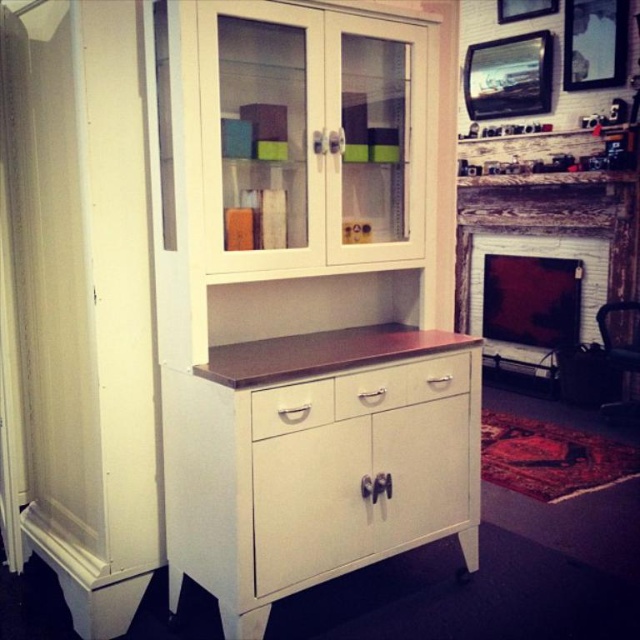
Based on the photo, between white wood dresser at center and white brick fireplace at center, which one is positioned lower?

white wood dresser at center is below.

In order to click on white wood dresser at center in this screenshot , I will do `click(312, 464)`.

Is point (266, 344) farther from viewer compared to point (492, 248)?

No, it is not.

Identify the location of white wood dresser at center. The height and width of the screenshot is (640, 640). (312, 464).

Can you confirm if white wood dresser at center is shorter than satin white drawer at center?

No.

Is white wood dresser at center thinner than satin white drawer at center?

No, white wood dresser at center is not thinner than satin white drawer at center.

The height and width of the screenshot is (640, 640). What are the coordinates of `white wood dresser at center` in the screenshot? It's located at (312, 464).

Is point (324, 384) farther from viewer compared to point (412, 376)?

No, (324, 384) is closer to viewer.

The height and width of the screenshot is (640, 640). What do you see at coordinates (291, 406) in the screenshot?
I see `white matte drawer at center` at bounding box center [291, 406].

Find the location of a particular element. white matte drawer at center is located at coordinates (291, 406).